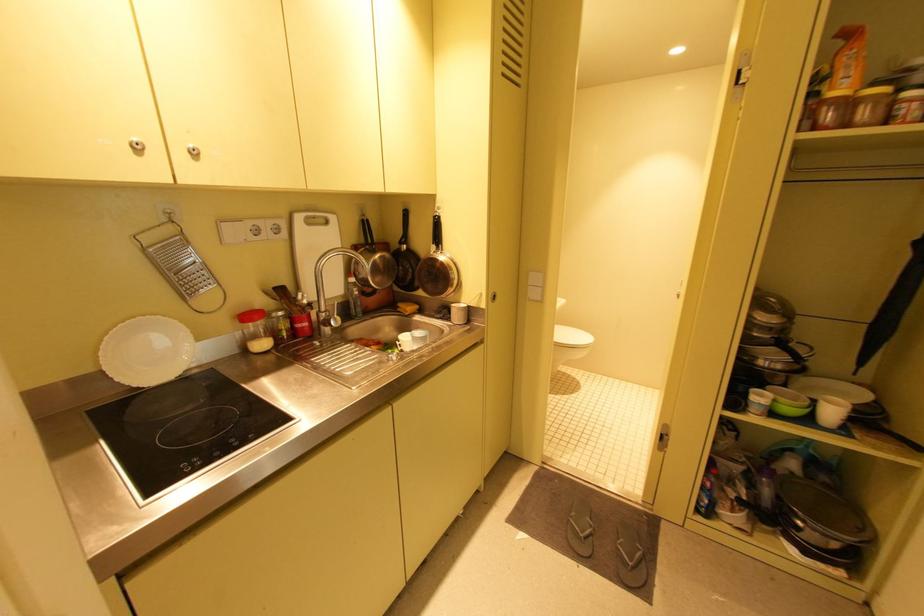
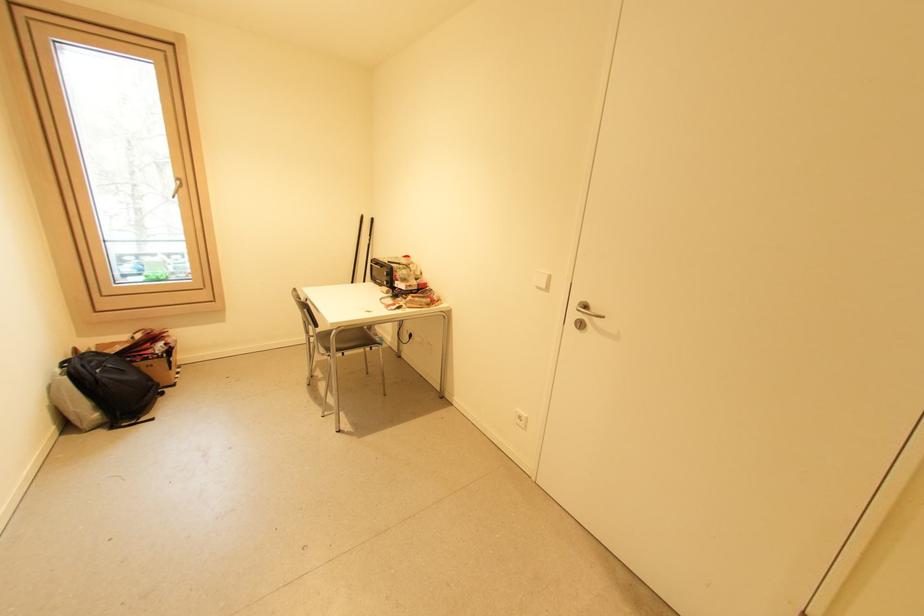
First-person continuous shooting, in which direction is the camera rotating?

The camera's rotation is toward left-down.